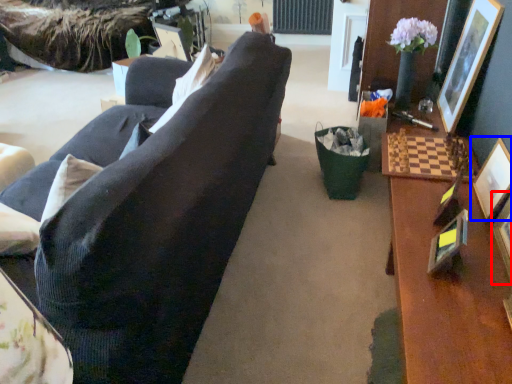
Question: Among these objects, which one is farthest to the camera, picture frame (highlighted by a red box) or picture frame (highlighted by a blue box)?

Choices:
 (A) picture frame
 (B) picture frame

Answer: (B)